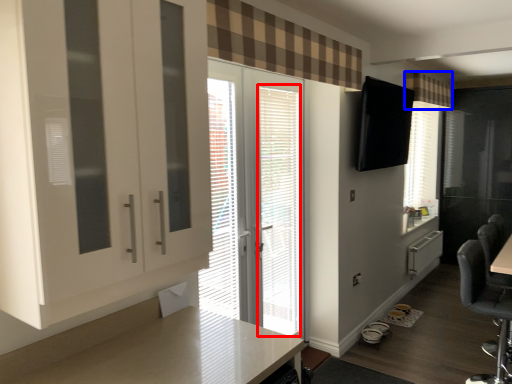
Question: Which of the following is the closest to the observer, blind (highlighted by a red box) or curtain (highlighted by a blue box)?

Choices:
 (A) blind
 (B) curtain

Answer: (A)